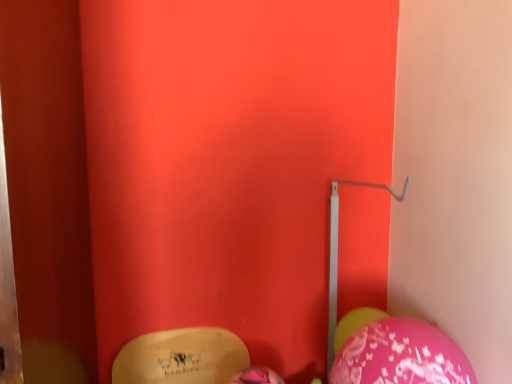
Measure the distance between pink glossy balloon at lower right, the 2th balloon positioned from the right, and camera.

They are 1.08 meters apart.

Find the location of `metallic silver trim at center-right`. metallic silver trim at center-right is located at coordinates (337, 252).

From the image's perspective, would you say metallic silver trim at center-right is positioned over pink glossy balloon at lower right, which appears as the 1th balloon when viewed from the left?

Correct, metallic silver trim at center-right appears higher than pink glossy balloon at lower right, which appears as the 1th balloon when viewed from the left, in the image.

Can you confirm if metallic silver trim at center-right is taller than pink glossy balloon at lower right, placed as the 2th balloon when sorted from back to front?

Yes.

Is metallic silver trim at center-right turned away from pink glossy balloon at lower right, placed as the 2th balloon when sorted from back to front?

No, pink glossy balloon at lower right, placed as the 2th balloon when sorted from back to front, is not at the back of metallic silver trim at center-right.

Which is behind, point (352, 331) or point (247, 375)?

The point (352, 331) is more distant.

Considering the relative sizes of pink glossy balloon at lower right, acting as the 1th balloon starting from the back, and pink glossy balloon at lower right, placed as the 2th balloon when sorted from back to front, in the image provided, is pink glossy balloon at lower right, acting as the 1th balloon starting from the back, thinner than pink glossy balloon at lower right, placed as the 2th balloon when sorted from back to front,?

Incorrect, the width of pink glossy balloon at lower right, acting as the 1th balloon starting from the back, is not less than that of pink glossy balloon at lower right, placed as the 2th balloon when sorted from back to front.

From a real-world perspective, relative to pink glossy balloon at lower right, the 2th balloon positioned from the right, is pink glossy balloon at lower right, positioned as the 2th balloon in front-to-back order, vertically above or below?

From a real-world perspective, pink glossy balloon at lower right, positioned as the 2th balloon in front-to-back order, is physically above pink glossy balloon at lower right, the 2th balloon positioned from the right.

Is pink glossy balloon at lower right, which ranks as the first balloon in right-to-left order, positioned with its back to pink glossy balloon at lower right, the 1th balloon viewed from the front?

pink glossy balloon at lower right, which ranks as the first balloon in right-to-left order, does not have its back to pink glossy balloon at lower right, the 1th balloon viewed from the front.

Which is behind, point (333, 347) or point (332, 311)?

The point (332, 311) is more distant.

Can you confirm if pink glossy balloon at lower right, which appears as the 2th balloon when viewed from the left, is bigger than metallic silver trim at center-right?

Incorrect, pink glossy balloon at lower right, which appears as the 2th balloon when viewed from the left, is not larger than metallic silver trim at center-right.

Does pink glossy balloon at lower right, which appears as the 2th balloon when viewed from the left, lie behind metallic silver trim at center-right?

Yes, the depth of pink glossy balloon at lower right, which appears as the 2th balloon when viewed from the left, is greater than that of metallic silver trim at center-right.

Can you tell me how much pink glossy balloon at lower right, acting as the 1th balloon starting from the back, and metallic silver trim at center-right differ in facing direction?

There is a 27.3-degree angle between the facing directions of pink glossy balloon at lower right, acting as the 1th balloon starting from the back, and metallic silver trim at center-right.

Based on the photo, would you say metallic silver trim at center-right is to the left or to the right of pink glossy balloon at lower right, positioned as the 2th balloon in front-to-back order, in the picture?

metallic silver trim at center-right is to the left of pink glossy balloon at lower right, positioned as the 2th balloon in front-to-back order.

Considering the relative sizes of metallic silver trim at center-right and pink glossy balloon at lower right, which ranks as the first balloon in right-to-left order, in the image provided, is metallic silver trim at center-right bigger than pink glossy balloon at lower right, which ranks as the first balloon in right-to-left order,?

Yes.

Considering the positions of point (329, 347) and point (346, 326), is point (329, 347) closer or farther from the camera than point (346, 326)?

Point (329, 347).

Identify the location of the 2nd balloon behind when counting from the metallic silver trim at center-right. (355, 324).

Would you say pink glossy balloon at lower right, the 2th balloon positioned from the right, is to the left or to the right of metallic silver trim at center-right in the picture?

In the image, pink glossy balloon at lower right, the 2th balloon positioned from the right, appears on the left side of metallic silver trim at center-right.

From the image's perspective, is pink glossy balloon at lower right, placed as the 2th balloon when sorted from back to front, on metallic silver trim at center-right?

No, from the image's perspective, pink glossy balloon at lower right, placed as the 2th balloon when sorted from back to front, is not on top of metallic silver trim at center-right.

From the picture: From a real-world perspective, who is located higher, pink glossy balloon at lower right, the 1th balloon viewed from the front, or metallic silver trim at center-right?

From a 3D spatial view, metallic silver trim at center-right is above.

Based on the photo, considering the relative sizes of pink glossy balloon at lower right, the 2th balloon positioned from the right, and pink glossy balloon at lower right, acting as the 1th balloon starting from the back, in the image provided, is pink glossy balloon at lower right, the 2th balloon positioned from the right, thinner than pink glossy balloon at lower right, acting as the 1th balloon starting from the back,?

Correct, the width of pink glossy balloon at lower right, the 2th balloon positioned from the right, is less than that of pink glossy balloon at lower right, acting as the 1th balloon starting from the back.

Consider the image. Which is nearer, (261, 370) or (378, 312)?

Point (261, 370) is positioned closer to the camera compared to point (378, 312).

Between pink glossy balloon at lower right, placed as the 2th balloon when sorted from back to front, and pink glossy balloon at lower right, which appears as the 2th balloon when viewed from the left, which one has more height?

pink glossy balloon at lower right, which appears as the 2th balloon when viewed from the left, is taller.

The height and width of the screenshot is (384, 512). I want to click on balloon on the right of pink glossy balloon at lower right, the 2th balloon positioned from the right, so click(x=355, y=324).

Starting from the metallic silver trim at center-right, which balloon is the 1st one behind? Please provide its 2D coordinates.

[(257, 376)]

I want to click on balloon located below the pink glossy balloon at lower right, which ranks as the first balloon in right-to-left order (from the image's perspective), so click(257, 376).

Based on the photo, based on their spatial positions, is pink glossy balloon at lower right, the 1th balloon viewed from the front, or pink glossy balloon at lower right, which appears as the 2th balloon when viewed from the left, further from metallic silver trim at center-right?

Among the two, pink glossy balloon at lower right, the 1th balloon viewed from the front, is located further to metallic silver trim at center-right.

Consider the image. When comparing their distances from pink glossy balloon at lower right, which appears as the 1th balloon when viewed from the left, does metallic silver trim at center-right or pink glossy balloon at lower right, which ranks as the first balloon in right-to-left order, seem further?

The object further to pink glossy balloon at lower right, which appears as the 1th balloon when viewed from the left, is metallic silver trim at center-right.

From the image, which object appears to be nearer to pink glossy balloon at lower right, acting as the 1th balloon starting from the back, pink glossy balloon at lower right, placed as the 2th balloon when sorted from back to front, or metallic silver trim at center-right?

Among the two, metallic silver trim at center-right is located nearer to pink glossy balloon at lower right, acting as the 1th balloon starting from the back.

From the image, which object appears to be nearer to pink glossy balloon at lower right, positioned as the 2th balloon in front-to-back order, metallic silver trim at center-right or pink glossy balloon at lower right, the 2th balloon positioned from the right?

Among the two, metallic silver trim at center-right is located nearer to pink glossy balloon at lower right, positioned as the 2th balloon in front-to-back order.

When comparing their distances from metallic silver trim at center-right, does pink glossy balloon at lower right, which ranks as the first balloon in right-to-left order, or pink glossy balloon at lower right, which appears as the 1th balloon when viewed from the left, seem closer?

pink glossy balloon at lower right, which ranks as the first balloon in right-to-left order, is positioned closer to the anchor metallic silver trim at center-right.

Estimate the real-world distances between objects in this image. Which object is further from pink glossy balloon at lower right, the 2th balloon positioned from the right, pink glossy balloon at lower right, which ranks as the first balloon in right-to-left order, or metallic silver trim at center-right?

metallic silver trim at center-right is positioned further to the anchor pink glossy balloon at lower right, the 2th balloon positioned from the right.

Locate an element on the screen. Image resolution: width=512 pixels, height=384 pixels. trim situated between pink glossy balloon at lower right, the 1th balloon viewed from the front, and pink glossy balloon at lower right, which ranks as the first balloon in right-to-left order, from left to right is located at coordinates (337, 252).